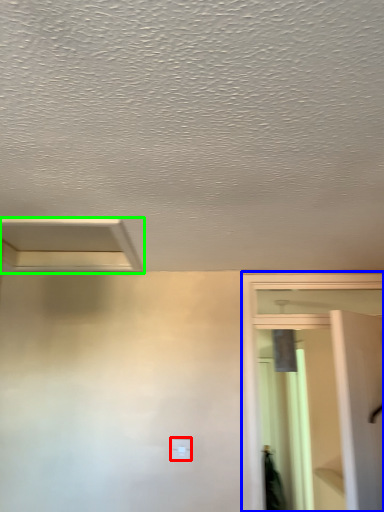
Question: Which object is the farthest from light switch (highlighted by a red box)? Choose among these: screen door (highlighted by a blue box) or exhaust hood (highlighted by a green box).

Choices:
 (A) screen door
 (B) exhaust hood

Answer: (B)